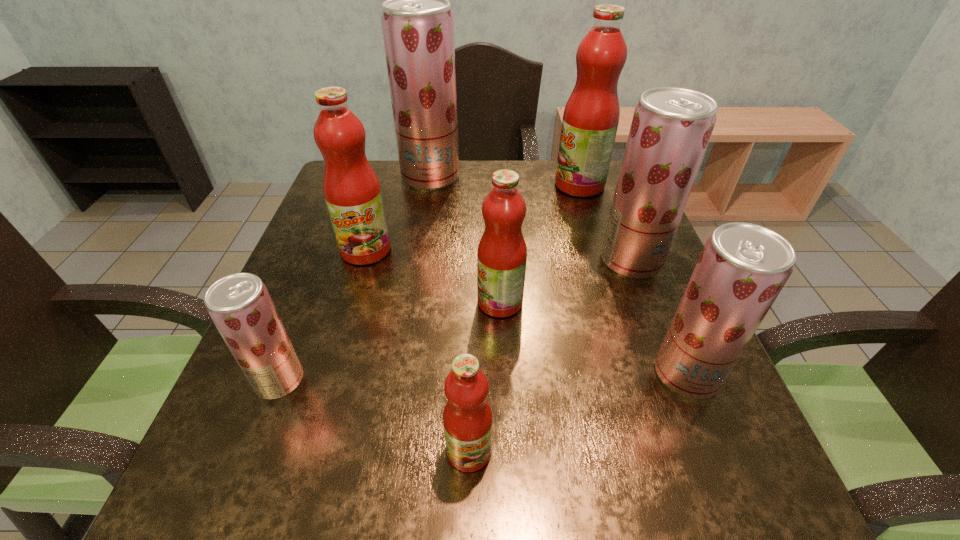
Where is `the biggest strawberry fruit juice`? The width and height of the screenshot is (960, 540). the biggest strawberry fruit juice is located at coordinates (417, 23).

At what (x,y) coordinates should I click in order to perform the action: click on the second strawberry fruit juice from left to right. Please return your answer as a coordinate pair (x, y). Looking at the image, I should click on (417, 23).

What are the coordinates of `the rightmost pink fruit juice` in the screenshot? It's located at (590, 121).

Locate an element on the screen. the farthest pink fruit juice is located at coordinates (590, 121).

Where is `the third smallest pink fruit juice`? This screenshot has width=960, height=540. the third smallest pink fruit juice is located at coordinates (352, 192).

This screenshot has height=540, width=960. What are the coordinates of `the second farthest pink fruit juice` in the screenshot? It's located at (352, 192).

The image size is (960, 540). Identify the location of the third smallest strawberry fruit juice. (671, 127).

Image resolution: width=960 pixels, height=540 pixels. I want to click on the fifth farthest fruit juice, so click(x=502, y=252).

Identify the location of the second nearest pink fruit juice. Image resolution: width=960 pixels, height=540 pixels. (502, 252).

Locate an element on the screen. the second smallest strawberry fruit juice is located at coordinates (742, 268).